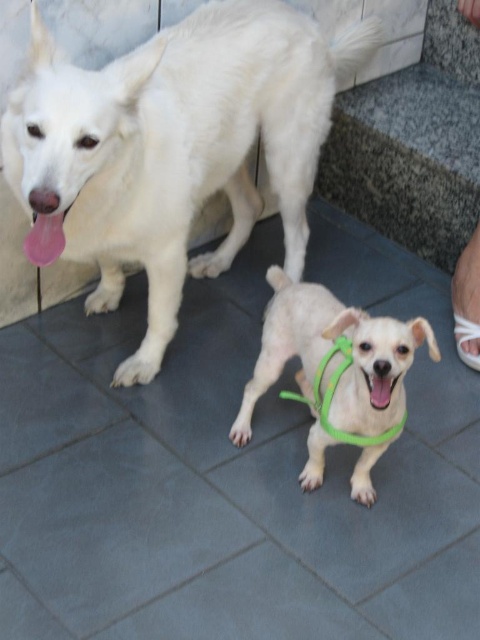
Question: Which of the following is the farthest from the observer?

Choices:
 (A) light brown fur at center
 (B) black matte mouth at center
 (C) green nylon leash at center

Answer: (C)

Question: Which point is closer to the camera?

Choices:
 (A) (367, 406)
 (B) (275, 45)
 (C) (348, 342)

Answer: (A)

Question: Which of the following is the farthest from the observer?

Choices:
 (A) (337, 378)
 (B) (348, 406)
 (C) (384, 396)
 (D) (245, 195)

Answer: (D)

Question: Does white fur dog at upper left lie in front of light brown fur at center?

Choices:
 (A) no
 (B) yes

Answer: (A)

Question: Does white fur dog at upper left lie in front of green nylon leash at center?

Choices:
 (A) yes
 (B) no

Answer: (A)

Question: Can you confirm if white fur dog at upper left is thinner than green nylon leash at center?

Choices:
 (A) yes
 (B) no

Answer: (B)